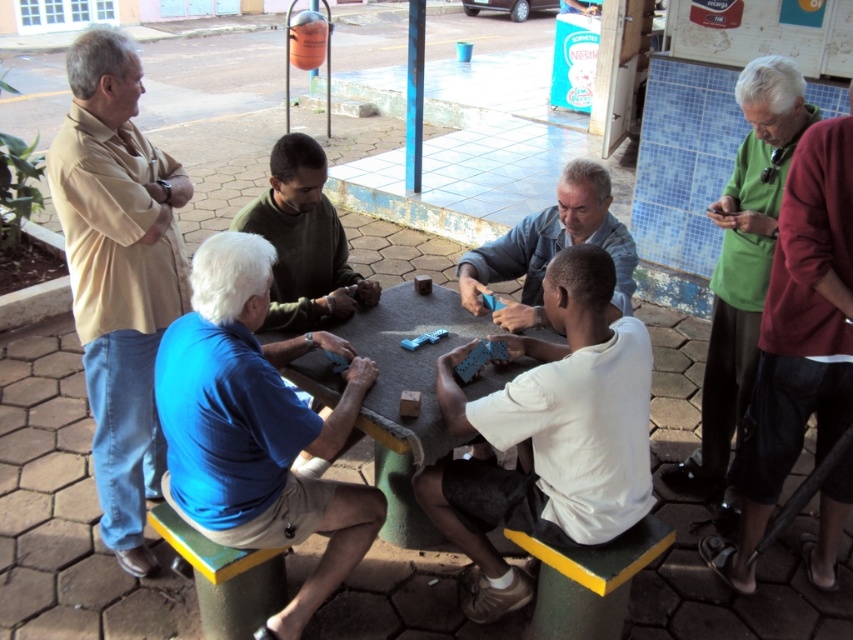
Question: Estimate the real-world distances between objects in this image. Which object is closer to the white matte shirt at center?

Choices:
 (A) beige cotton shirt at left
 (B) blue cotton shirt at lower left
 (C) light blue fabric shirt at center
 (D) green matte shirt at upper right

Answer: (C)

Question: Which point is closer to the camera?

Choices:
 (A) (45, 164)
 (B) (717, 214)
 (C) (509, 474)
 (D) (276, 490)

Answer: (D)

Question: Is blue cotton shirt at lower left positioned before smooth gray table at center?

Choices:
 (A) no
 (B) yes

Answer: (B)

Question: Is the position of green matte shirt at upper right less distant than that of light blue fabric shirt at center?

Choices:
 (A) yes
 (B) no

Answer: (B)

Question: Estimate the real-world distances between objects in this image. Which object is closer to the beige cotton shirt at left?

Choices:
 (A) light blue fabric shirt at center
 (B) green matte shirt at upper right
 (C) green matte shirt at center
 (D) white matte shirt at center

Answer: (C)

Question: Does blue cotton shirt at lower left have a greater width compared to green matte shirt at center?

Choices:
 (A) no
 (B) yes

Answer: (B)